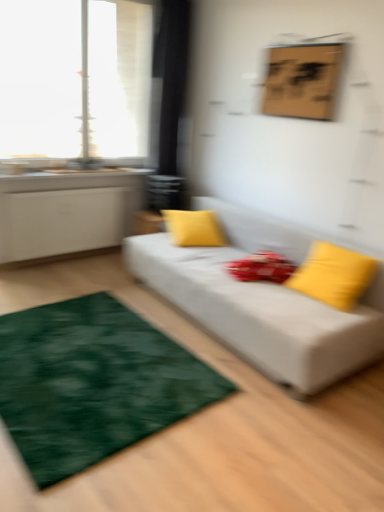
Question: In terms of width, does yellow fabric pillow at center, the first pillow positioned from the back, look wider or thinner when compared to white fabric couch at center?

Choices:
 (A) thin
 (B) wide

Answer: (A)

Question: Would you say yellow fabric pillow at center, which is counted as the second pillow, starting from the front, is inside or outside white fabric couch at center?

Choices:
 (A) inside
 (B) outside

Answer: (A)

Question: Considering the real-world distances, which object is closest to the yellow matte pillow at right, which is the second pillow in left-to-right order?

Choices:
 (A) white fabric couch at center
 (B) wooden board at upper center
 (C) yellow fabric pillow at center, the first pillow positioned from the back
 (D) transparent glass window at upper left
 (E) green plush rug at lower left

Answer: (A)

Question: Based on their relative distances, which object is farther from the yellow matte pillow at right, which is the first pillow from front to back?

Choices:
 (A) yellow fabric pillow at center, the first pillow when ordered from left to right
 (B) green plush rug at lower left
 (C) white fabric couch at center
 (D) wooden board at upper center
 (E) transparent glass window at upper left

Answer: (E)